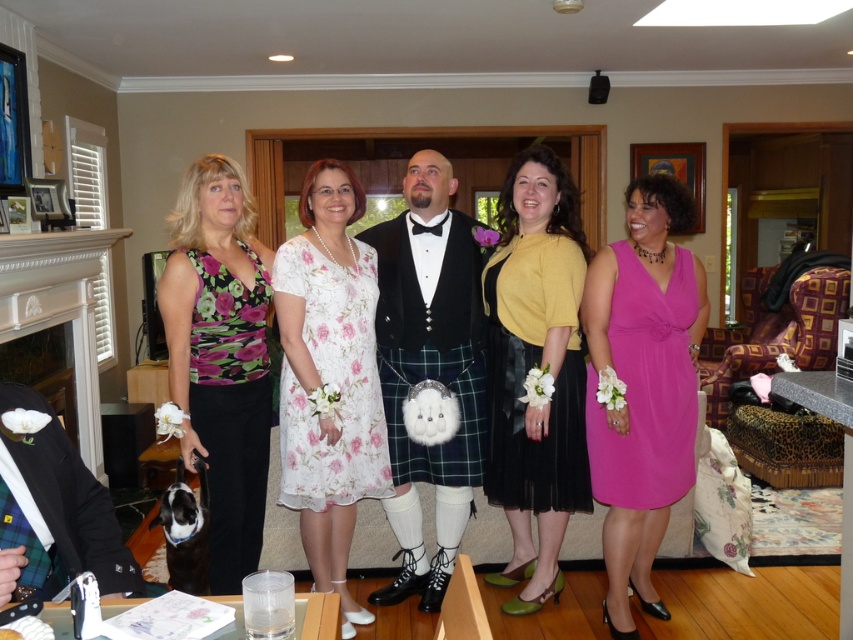
At what (x,y) coordinates should I click in order to perform the action: click on floral fabric dress at center. Please return your answer as a coordinate pair (x, y). This screenshot has height=640, width=853. Looking at the image, I should click on (422, 369).

Where is `floral fabric dress at center`? This screenshot has height=640, width=853. floral fabric dress at center is located at coordinates (422, 369).

Where is `floral fabric dress at center`? floral fabric dress at center is located at coordinates (422, 369).

Does point (372, 433) lie behind point (473, 348)?

No, it is not.

Is point (318, 262) positioned in front of point (456, 440)?

That is True.

The image size is (853, 640). In order to click on floral chiffon dress at center in this screenshot , I will do `click(331, 381)`.

Which is more to the left, floral fabric dress at center or black plaid kilt at center?

From the viewer's perspective, black plaid kilt at center appears more on the left side.

Does floral fabric dress at center have a greater width compared to black plaid kilt at center?

Correct, the width of floral fabric dress at center exceeds that of black plaid kilt at center.

This screenshot has height=640, width=853. Identify the location of floral fabric dress at center. (422, 369).